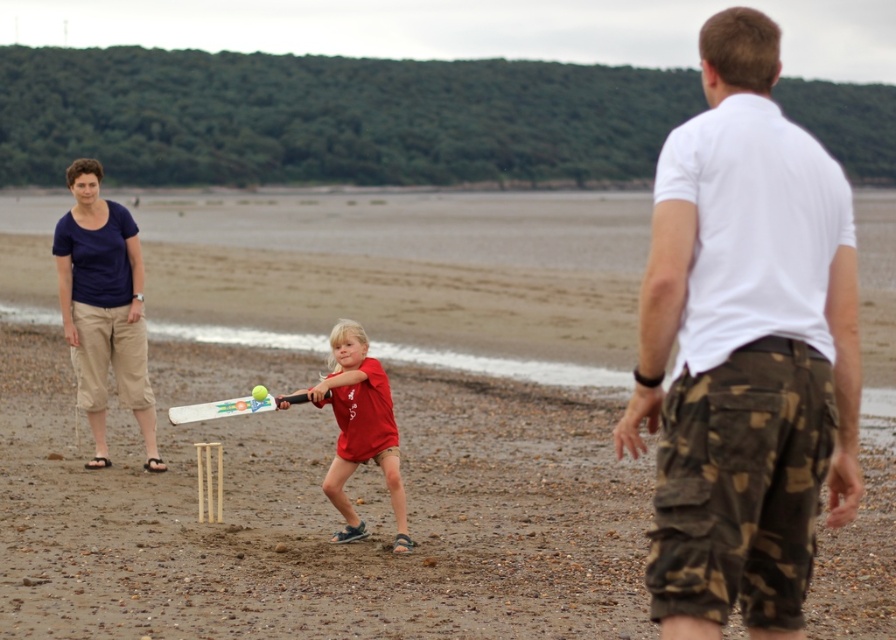
Question: Does white camo shorts at right appear over dark blue cotton t-shirt at left?

Choices:
 (A) yes
 (B) no

Answer: (A)

Question: Considering the real-world distances, which object is closest to the dark blue cotton t-shirt at left?

Choices:
 (A) smooth sand at center
 (B) matte red shirt at center
 (C) white camo shorts at right
 (D) white plastic bat at center

Answer: (D)

Question: Which of these objects is positioned farthest from the white camo shorts at right?

Choices:
 (A) smooth sand at center
 (B) dark blue cotton t-shirt at left
 (C) matte red shirt at center

Answer: (A)

Question: Does smooth sand at center have a smaller size compared to dark blue cotton t-shirt at left?

Choices:
 (A) no
 (B) yes

Answer: (A)

Question: Considering the real-world distances, which object is closest to the dark blue cotton t-shirt at left?

Choices:
 (A) white camo shorts at right
 (B) matte red shirt at center

Answer: (B)

Question: Is smooth sand at center to the left of matte red shirt at center from the viewer's perspective?

Choices:
 (A) no
 (B) yes

Answer: (A)